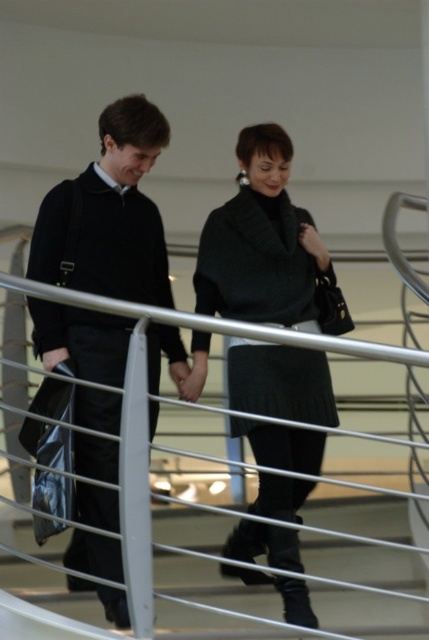
Question: Which object is farther from the camera taking this photo?

Choices:
 (A) matte black sweater at center
 (B) white metal railing at center
 (C) matte black coat at left

Answer: (A)

Question: Which of the following is the farthest from the observer?

Choices:
 (A) matte black sweater at center
 (B) knitted black dress at center
 (C) white metal railing at center

Answer: (B)

Question: In this image, where is matte black sweater at center located relative to knitted black dress at center?

Choices:
 (A) above
 (B) below

Answer: (B)

Question: Which of the following is the farthest from the observer?

Choices:
 (A) knitted black dress at center
 (B) matte black sweater at center
 (C) matte black coat at left
 (D) white metal railing at center

Answer: (A)

Question: Where is matte black sweater at center located in relation to knitted black dress at center in the image?

Choices:
 (A) below
 (B) above

Answer: (A)

Question: Does matte black sweater at center appear on the right side of knitted black dress at center?

Choices:
 (A) no
 (B) yes

Answer: (A)